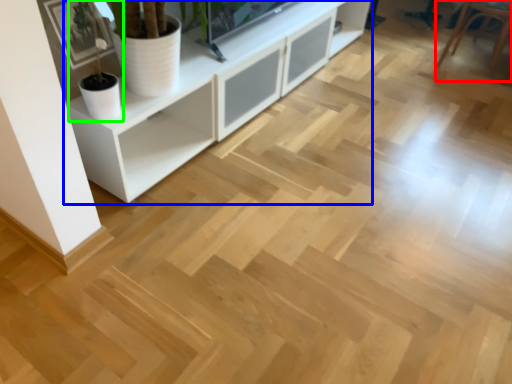
Question: Which is nearer to the armchair (highlighted by a red box)? cabinetry (highlighted by a blue box) or houseplant (highlighted by a green box).

Choices:
 (A) cabinetry
 (B) houseplant

Answer: (A)